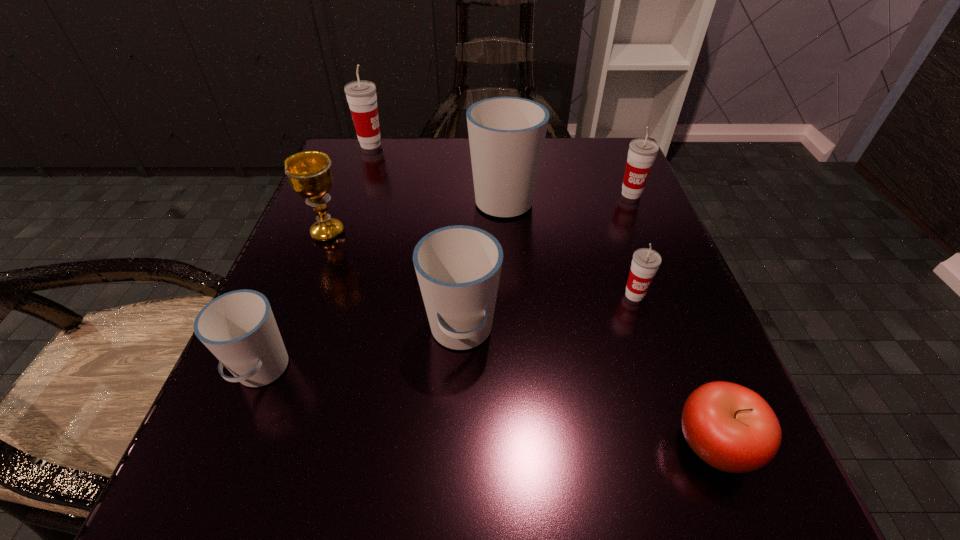
I want to click on vacant space that satisfies the following two spatial constraints: 1. on the side of the farthest cup with the logo; 2. on the front side of the gold chalice, so click(339, 233).